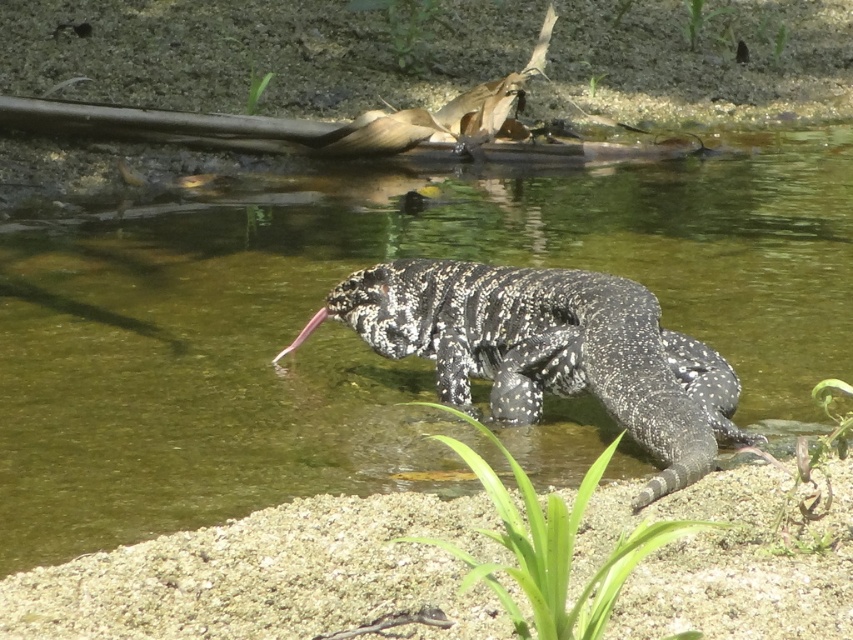
Is clear water at center wider than speckled scaly lizard at center?

Yes.

Which is more to the right, clear water at center or speckled scaly lizard at center?

Positioned to the right is speckled scaly lizard at center.

This screenshot has width=853, height=640. I want to click on clear water at center, so click(x=357, y=339).